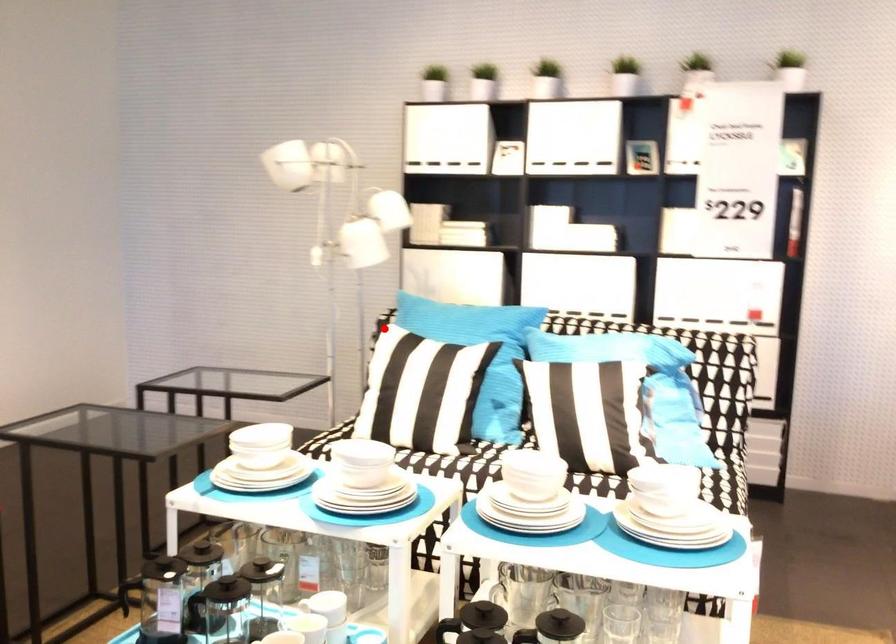
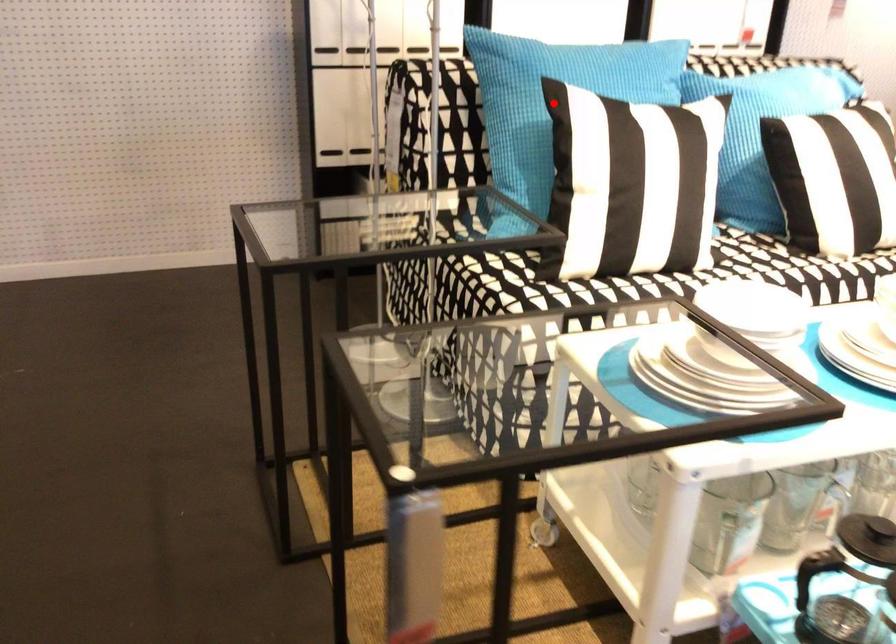
I am providing you with two images of the same scene from different viewpoints. A red point is marked on the first image and another point is marked on the second image. Is the red point in image1 aligned with the point shown in image2?

Yes